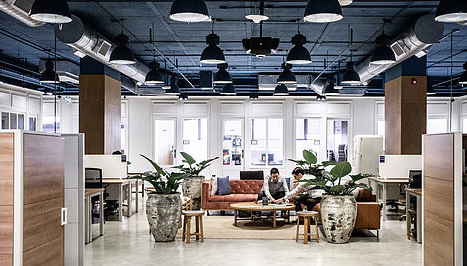
Locate an element on the screen. Image resolution: width=467 pixels, height=266 pixels. 4 large vases is located at coordinates 341,219, 167,225, 320,189, 192,187.